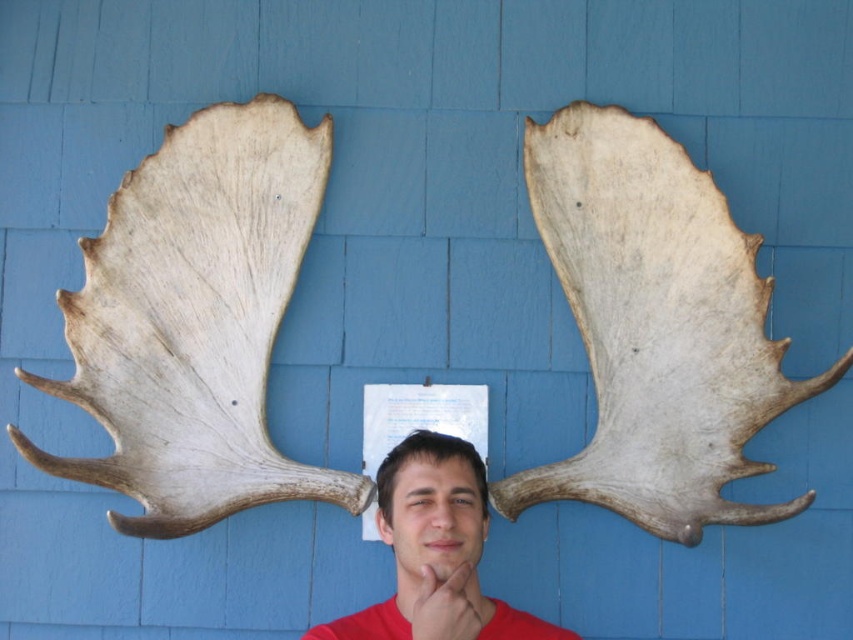
From the picture: Does matte red shirt at center have a smaller size compared to matte brown hair at center?

Actually, matte red shirt at center might be larger than matte brown hair at center.

Which is below, matte red shirt at center or matte brown hair at center?

matte red shirt at center is below.

Is point (401, 515) positioned before point (421, 452)?

Yes, point (401, 515) is in front of point (421, 452).

Where is `matte red shirt at center`? matte red shirt at center is located at coordinates (434, 548).

Is matte brown hair at center further to the viewer compared to matte skin at center?

Yes, it is.

Is matte brown hair at center smaller than matte skin at center?

Actually, matte brown hair at center might be larger than matte skin at center.

I want to click on matte brown hair at center, so click(x=432, y=502).

Who is more forward, (428, 513) or (466, 564)?

Point (466, 564) is in front.

Between matte red shirt at center and matte skin at center, which one appears on the left side from the viewer's perspective?

Positioned to the left is matte red shirt at center.

Who is more distant from viewer, (402, 554) or (437, 566)?

Positioned behind is point (402, 554).

I want to click on matte red shirt at center, so click(x=434, y=548).